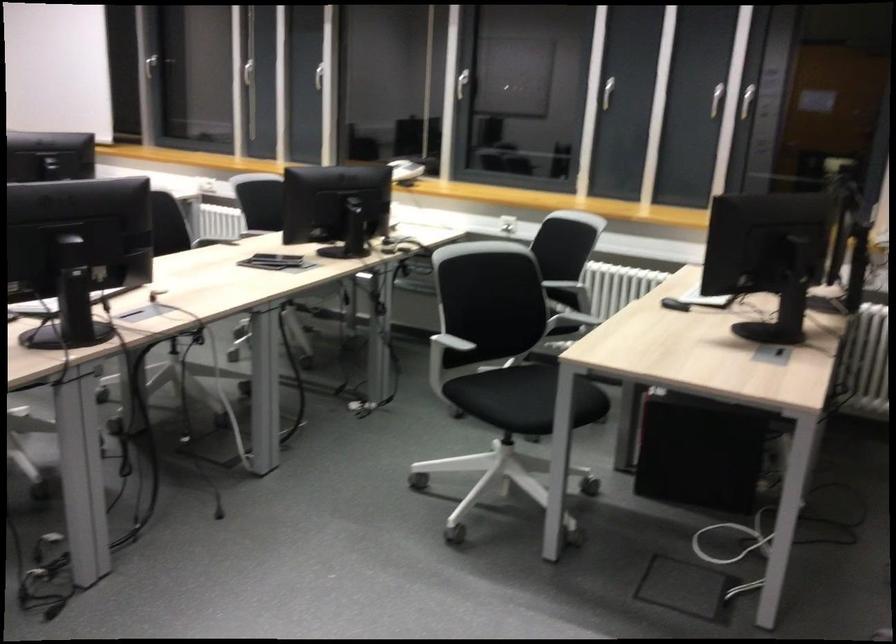
Where is `phone handset`? This screenshot has height=644, width=896. phone handset is located at coordinates (400, 163).